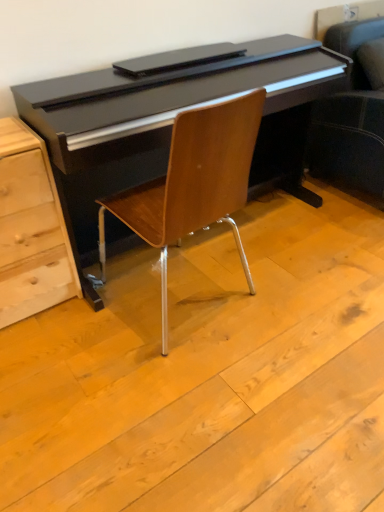
This screenshot has width=384, height=512. I want to click on vacant space in front of light wood chest of drawers at lower left, so click(38, 354).